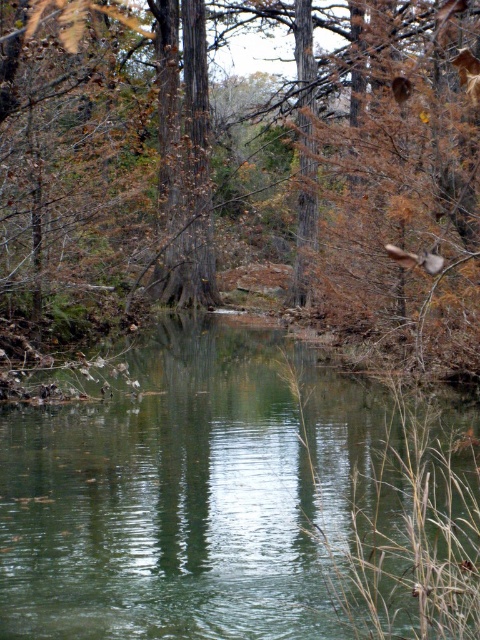
Is green smooth water at center taller than brown wood tree at center?

No, green smooth water at center is not taller than brown wood tree at center.

Does point (239, 337) lie in front of point (90, 36)?

No.

Where is `green smooth water at center`? Image resolution: width=480 pixels, height=640 pixels. green smooth water at center is located at coordinates (239, 502).

This screenshot has height=640, width=480. I want to click on green smooth water at center, so click(239, 502).